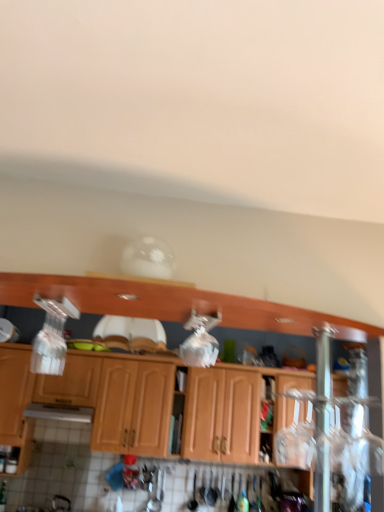
Question: Is point (193, 435) closer or farther from the camera than point (160, 291)?

Choices:
 (A) farther
 (B) closer

Answer: (A)

Question: From a real-world perspective, is wooden cabinet at center, the 1th cabinetry positioned from the back, physically located above or below wooden cabinets at center, the first cabinetry in the front-to-back sequence?

Choices:
 (A) below
 (B) above

Answer: (A)

Question: Considering the real-world distances, which object is farthest from the wooden cabinets at center, the first cabinetry in the front-to-back sequence?

Choices:
 (A) wooden cabinet at center, the 3th cabinetry positioned from the front
 (B) wooden cabinet at center, which is counted as the second cabinetry, starting from the back

Answer: (A)

Question: Which of these objects is positioned closest to the wooden cabinet at center, the 3th cabinetry positioned from the front?

Choices:
 (A) wooden cabinet at center, the 2th cabinetry positioned from the front
 (B) wooden cabinets at center, placed as the 3th cabinetry when sorted from back to front

Answer: (A)